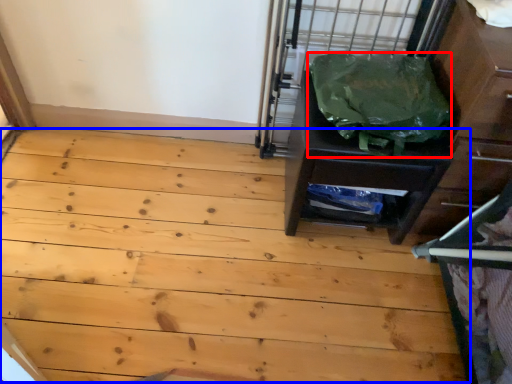
Question: Among these objects, which one is farthest to the camera, garbage (highlighted by a red box) or plywood (highlighted by a blue box)?

Choices:
 (A) garbage
 (B) plywood

Answer: (B)